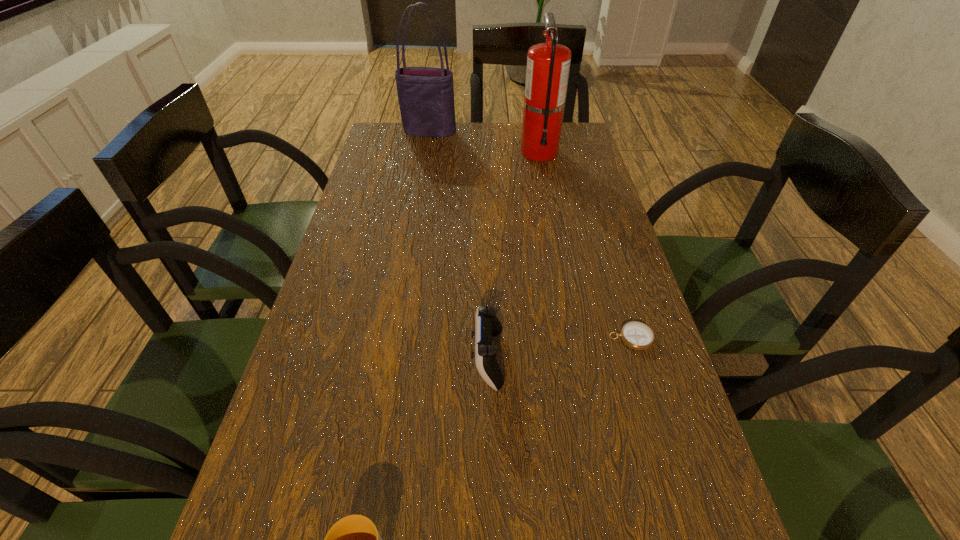
I want to click on object that is the closest one to the rightmost object, so click(x=487, y=325).

This screenshot has height=540, width=960. Find the location of `vacant space that satisfies the following two spatial constraints: 1. at the nozzle of the fire extinguisher; 2. on the left side of the rightmost object`. vacant space that satisfies the following two spatial constraints: 1. at the nozzle of the fire extinguisher; 2. on the left side of the rightmost object is located at coordinates (574, 338).

At what (x,y) coordinates should I click in order to perform the action: click on vacant space that satisfies the following two spatial constraints: 1. at the nozzle of the fourth nearest object; 2. on the right side of the shortest object. Please return your answer as a coordinate pair (x, y). This screenshot has height=540, width=960. Looking at the image, I should click on (574, 338).

At what (x,y) coordinates should I click in order to perform the action: click on blank space that satisfies the following two spatial constraints: 1. at the nozzle of the second object from right to left; 2. on the right side of the shortest object. Please return your answer as a coordinate pair (x, y). This screenshot has width=960, height=540. Looking at the image, I should click on (x=574, y=338).